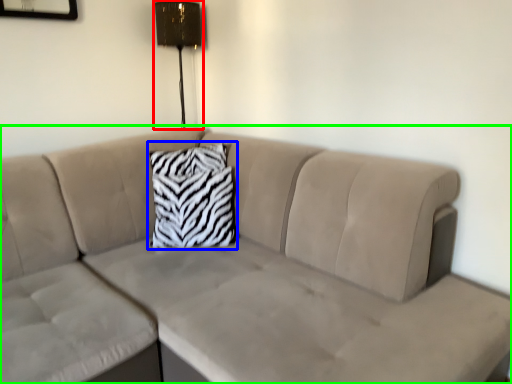
Question: Estimate the real-world distances between objects in this image. Which object is farther from lamp (highlighted by a red box), pillow (highlighted by a blue box) or studio couch (highlighted by a green box)?

Choices:
 (A) pillow
 (B) studio couch

Answer: (B)